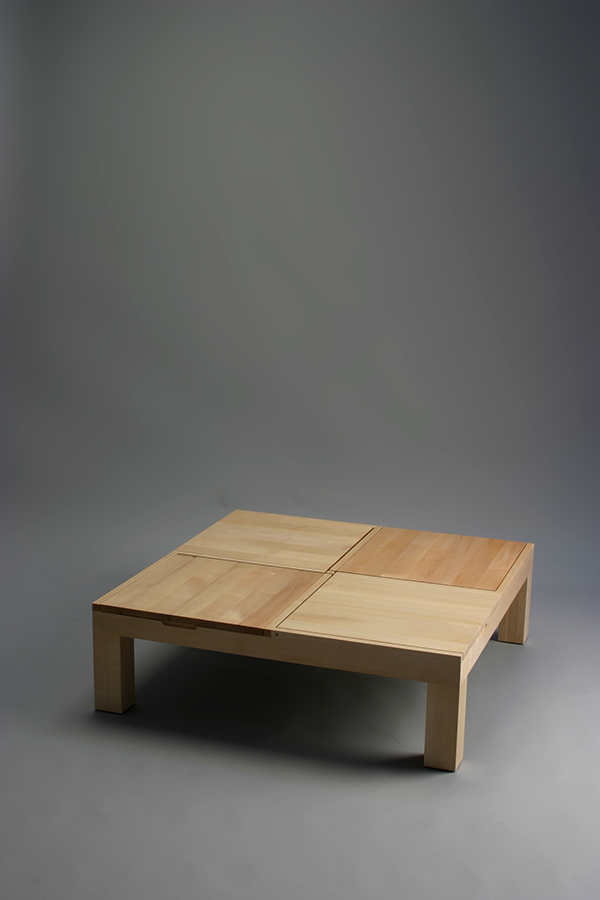
Find the location of a particular element. This screenshot has height=900, width=600. the left top corner of table is located at coordinates (266, 536).